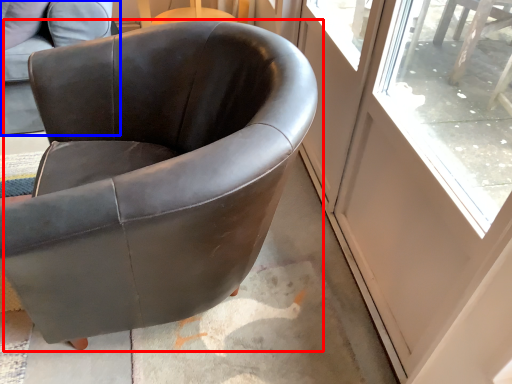
Question: Which of the following is the closest to the observer, chair (highlighted by a red box) or chair (highlighted by a blue box)?

Choices:
 (A) chair
 (B) chair

Answer: (A)